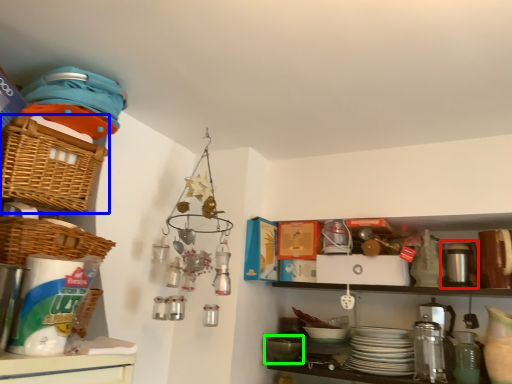
Question: Estimate the real-world distances between objects in this image. Which object is closer to appliance (highlighted by a red box), basket (highlighted by a blue box) or mixing bowl (highlighted by a green box)?

Choices:
 (A) basket
 (B) mixing bowl

Answer: (B)